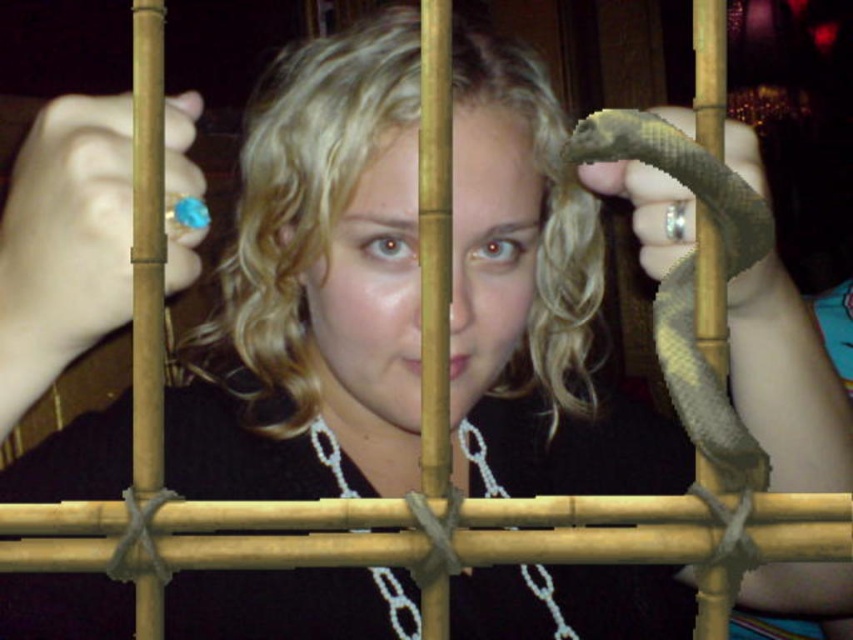
Question: Does green matte snake at center appear under silver metallic chain at center?

Choices:
 (A) no
 (B) yes

Answer: (A)

Question: Where is green matte snake at center located in relation to silver metallic chain at center in the image?

Choices:
 (A) above
 (B) below

Answer: (A)

Question: Which object appears closest to the camera in this image?

Choices:
 (A) green matte snake at center
 (B) silver metallic chain at center

Answer: (A)

Question: Does green matte snake at center have a greater width compared to silver metallic chain at center?

Choices:
 (A) yes
 (B) no

Answer: (B)

Question: Which of the following is the farthest from the observer?

Choices:
 (A) [590, 132]
 (B) [549, 593]

Answer: (B)

Question: Which point is farther to the camera?

Choices:
 (A) green matte snake at center
 (B) silver metallic chain at center

Answer: (B)